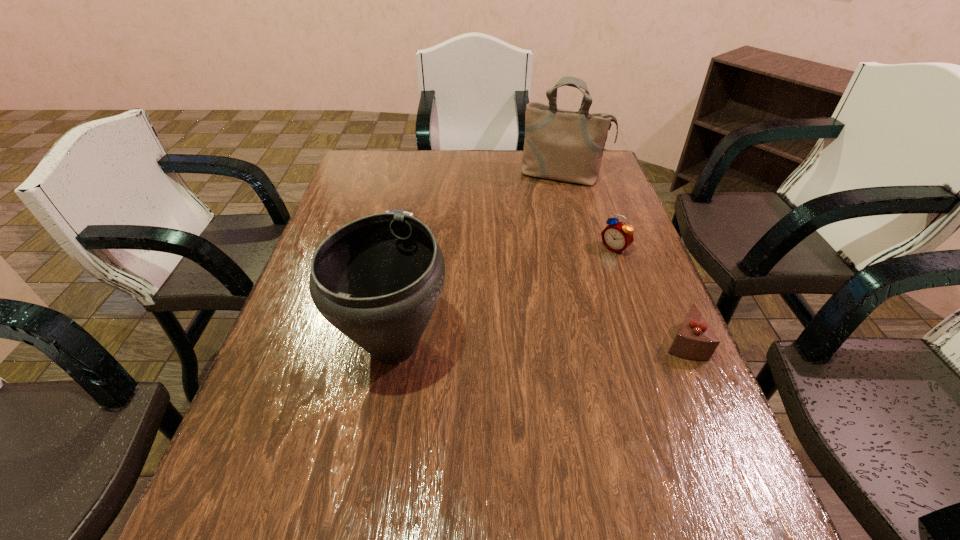
At what (x,y) coordinates should I click in order to perform the action: click on free space at the near right corner. Please return your answer as a coordinate pair (x, y). The image size is (960, 540). Looking at the image, I should click on (653, 462).

Image resolution: width=960 pixels, height=540 pixels. Find the location of `empty location between the shortest object and the alarm clock`. empty location between the shortest object and the alarm clock is located at coordinates coord(500,239).

Identify the location of free space between the third shortest object and the chocolate cake. (648, 295).

You are a GUI agent. You are given a task and a screenshot of the screen. Output one action in this format:
    pyautogui.click(x=<x>, y=<y>)
    Task: Click on the free space between the second shortest object and the goggles
    
    Given the screenshot: What is the action you would take?
    pyautogui.click(x=534, y=285)

The width and height of the screenshot is (960, 540). In order to click on vacant space that's between the goggles and the tallest object in this screenshot , I will do `click(474, 202)`.

The image size is (960, 540). What are the coordinates of `free point between the shortest object and the tallest object` in the screenshot? It's located at (474, 202).

Find the location of a particular element. This screenshot has height=540, width=960. free point between the goggles and the alarm clock is located at coordinates (500, 239).

I want to click on vacant point located between the goggles and the tallest object, so click(474, 202).

Locate an element on the screen. free space that is in between the alarm clock and the urn is located at coordinates (504, 298).

At what (x,y) coordinates should I click in order to perform the action: click on vacant area between the chocolate cake and the alarm clock. Please return your answer as a coordinate pair (x, y). This screenshot has height=540, width=960. Looking at the image, I should click on (648, 295).